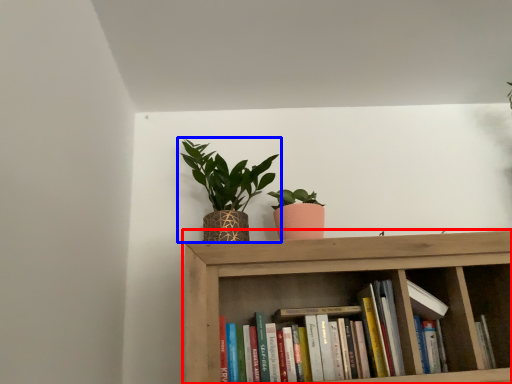
Question: Which object appears farthest to the camera in this image, shelf (highlighted by a red box) or houseplant (highlighted by a blue box)?

Choices:
 (A) shelf
 (B) houseplant

Answer: (B)